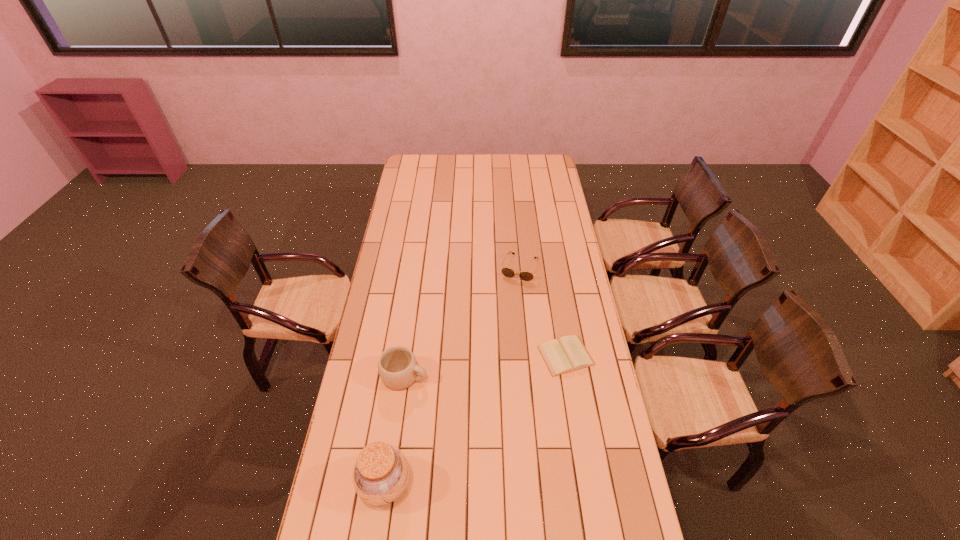
At what (x,y) coordinates should I click in order to perform the action: click on vacant spot on the desktop that is between the jar and the shortest object and is positioned on the side of the mug with the handle. Please return your answer as a coordinate pair (x, y). Looking at the image, I should click on pos(501,401).

Locate an element on the screen. The height and width of the screenshot is (540, 960). vacant space on the desktop that is between the tallest object and the diary and is positioned on the lenses of the farthest object is located at coordinates (466, 427).